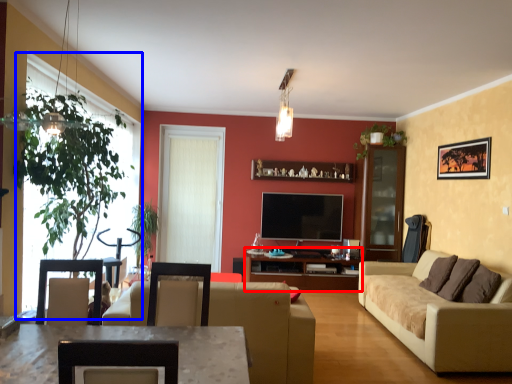
Question: Which point is further to the camera, entertainment center (highlighted by a red box) or window (highlighted by a blue box)?

Choices:
 (A) entertainment center
 (B) window

Answer: (A)